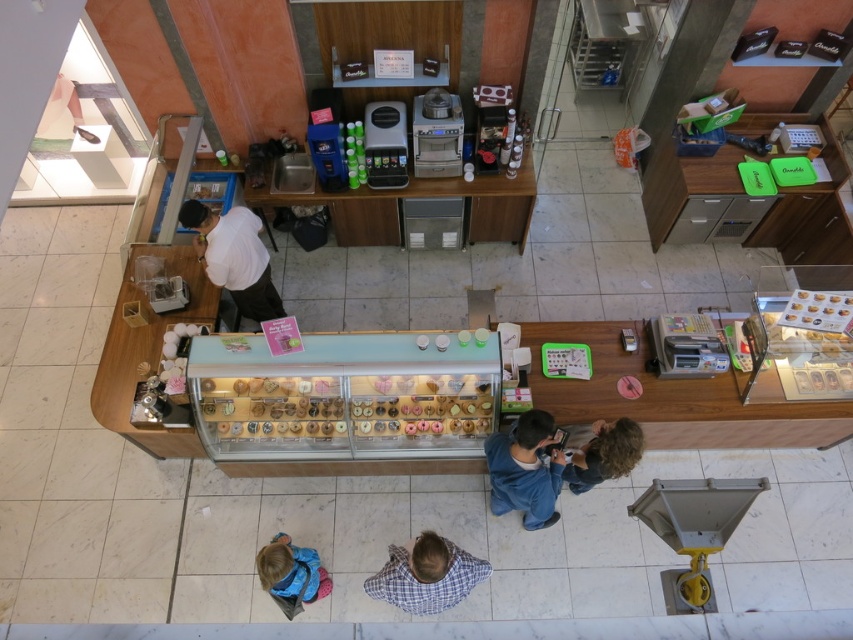
Which is behind, point (550, 468) or point (283, 589)?

Positioned behind is point (283, 589).

Is blue cotton shirt at lower center taller than blue fleece jacket at lower left?

Indeed, blue cotton shirt at lower center has a greater height compared to blue fleece jacket at lower left.

Is point (500, 433) farther from viewer compared to point (328, 589)?

No, (500, 433) is closer to viewer.

Locate an element on the screen. blue cotton shirt at lower center is located at coordinates (525, 468).

Is point (328, 592) behind point (625, 461)?

Yes, point (328, 592) is farther from viewer.

Looking at this image, is blue fleece jacket at lower left taller than curly hair at lower right?

Yes, blue fleece jacket at lower left is taller than curly hair at lower right.

The image size is (853, 640). What do you see at coordinates (291, 573) in the screenshot? I see `blue fleece jacket at lower left` at bounding box center [291, 573].

At what (x,y) coordinates should I click in order to perform the action: click on blue fleece jacket at lower left. Please return your answer as a coordinate pair (x, y). The width and height of the screenshot is (853, 640). Looking at the image, I should click on (291, 573).

Is blue plaid shirt at center positioned behind curly hair at lower right?

That is False.

Consider the image. Who is higher up, blue plaid shirt at center or curly hair at lower right?

curly hair at lower right is higher up.

What do you see at coordinates (426, 576) in the screenshot? The image size is (853, 640). I see `blue plaid shirt at center` at bounding box center [426, 576].

Image resolution: width=853 pixels, height=640 pixels. What are the coordinates of `blue plaid shirt at center` in the screenshot? It's located at (426, 576).